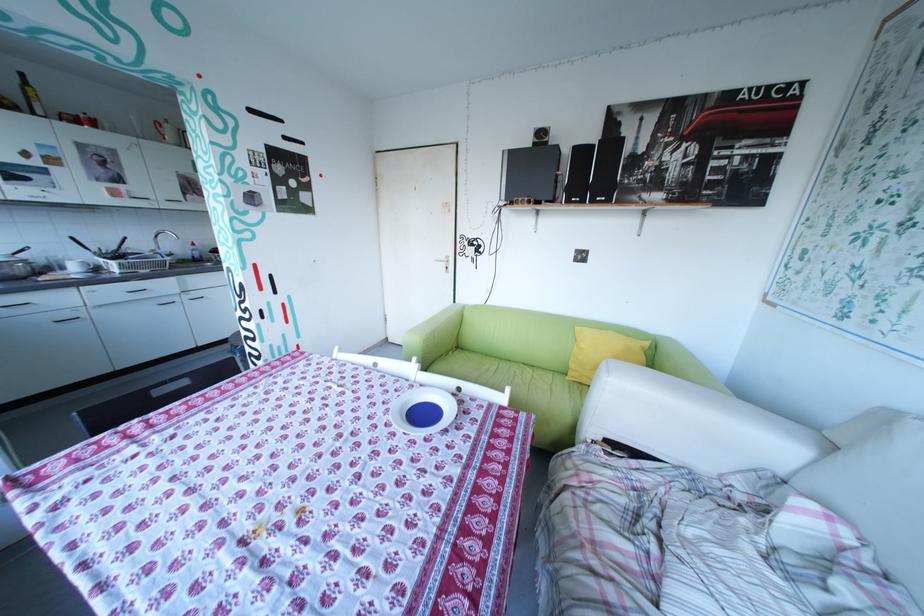
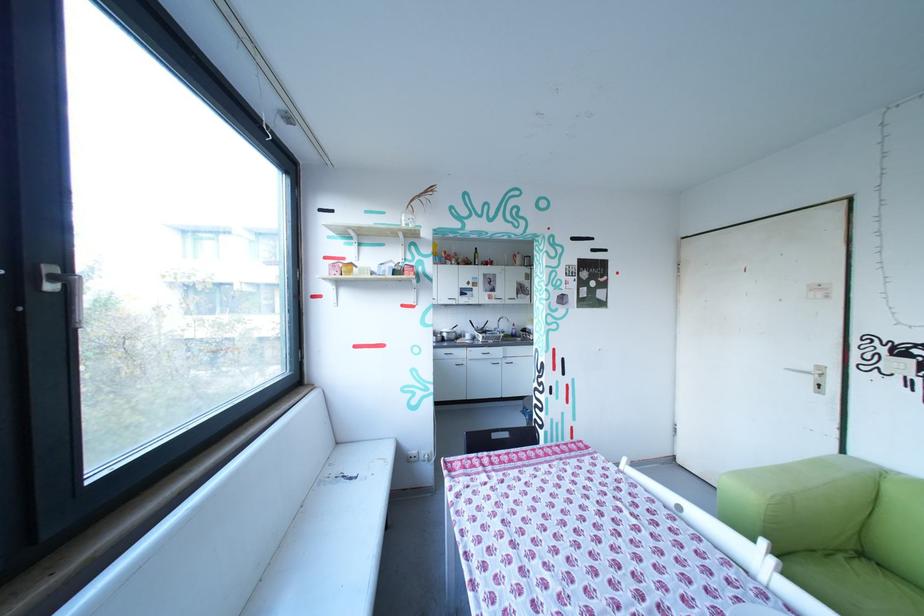
Question: The camera is either moving clockwise (left) or counter-clockwise (right) around the object. The first image is from the beginning of the video and the second image is from the end. Is the camera moving left or right when shooting the video?

Choices:
 (A) Left
 (B) Right

Answer: (B)